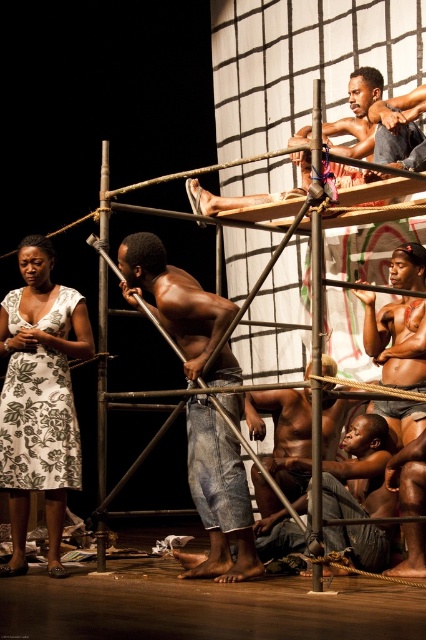
Question: Which object is the farthest from the shiny brown skin at center?

Choices:
 (A) shiny metallic pole at center
 (B) denim jeans at center
 (C) shiny metallic chain at upper center

Answer: (B)

Question: Which object is farther from the camera taking this photo?

Choices:
 (A) white floral dress at left
 (B) shiny metallic chain at upper center

Answer: (B)

Question: Can you confirm if shiny brown skin at center is smaller than shiny metallic chain at upper center?

Choices:
 (A) yes
 (B) no

Answer: (A)

Question: Among these objects, which one is nearest to the camera?

Choices:
 (A) denim jeans at center
 (B) white floral dress at left
 (C) shiny brown skin at center
 (D) shiny metallic chain at upper center

Answer: (A)

Question: Does denim jeans at center appear on the right side of shiny metallic chain at upper center?

Choices:
 (A) no
 (B) yes

Answer: (A)

Question: From the image, what is the correct spatial relationship of shiny brown skin at center in relation to shiny metallic chain at upper center?

Choices:
 (A) below
 (B) above

Answer: (A)